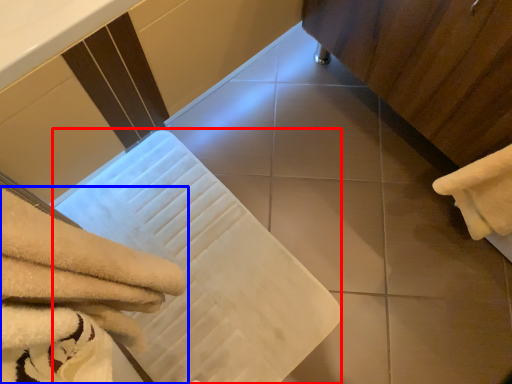
Question: Among these objects, which one is nearest to the camera, bath towel (highlighted by a red box) or towel (highlighted by a blue box)?

Choices:
 (A) bath towel
 (B) towel

Answer: (B)